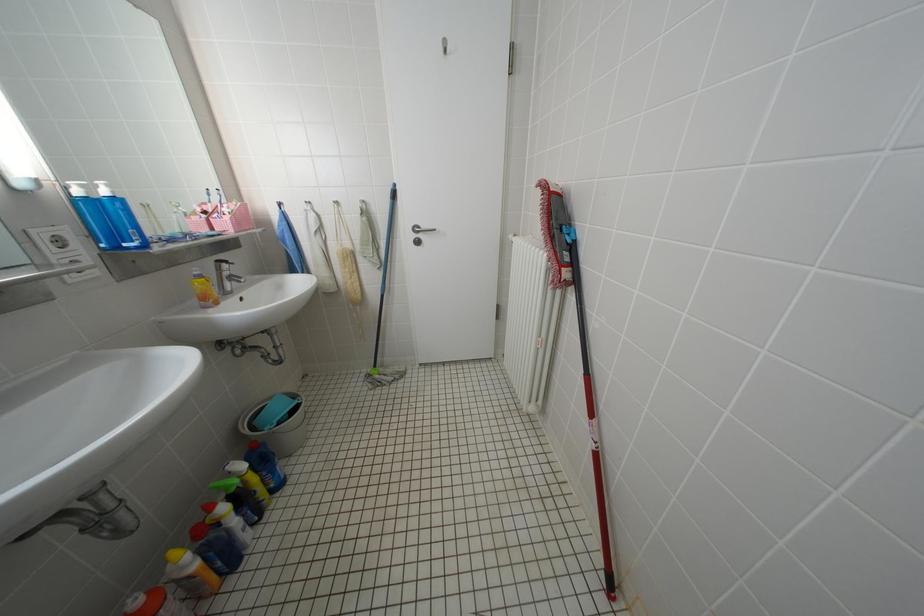
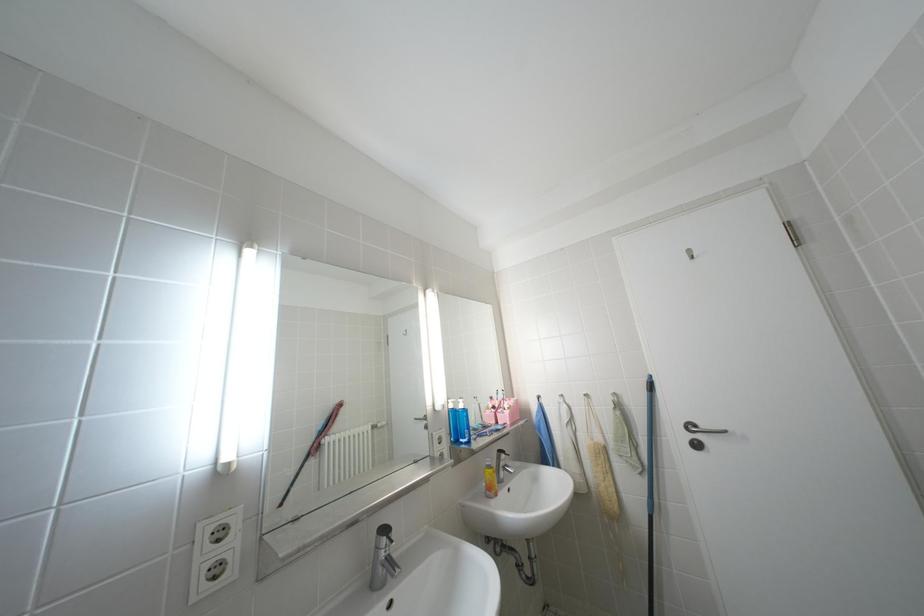
First-person continuous shooting, in which direction is the camera rotating?

The camera's rotation is toward left-up.